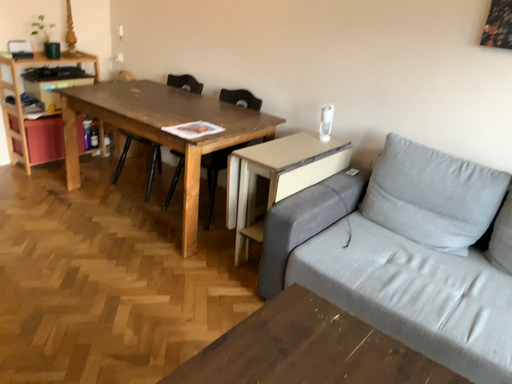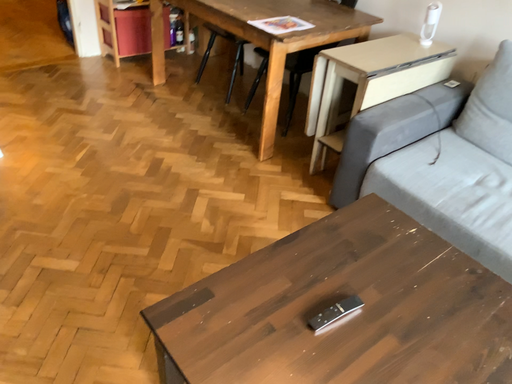
Question: Which way did the camera rotate in the video?

Choices:
 (A) rotated right
 (B) rotated left

Answer: (B)